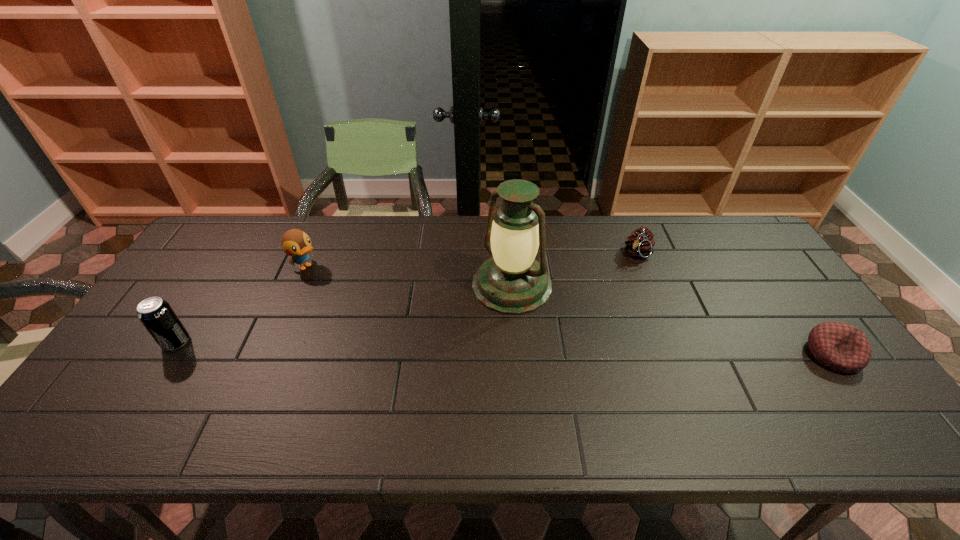
Find the location of `free space located 0.300m on the front-facing side of the duck`. free space located 0.300m on the front-facing side of the duck is located at coordinates (384, 316).

Locate an element on the screen. vacant region located on the front-facing side of the duck is located at coordinates (376, 312).

What are the coordinates of `blank area located 0.200m on the front-facing side of the duck` in the screenshot? It's located at (359, 301).

Where is `free space located 0.310m with a leaf charm attached to the fourth tallest object`? The height and width of the screenshot is (540, 960). free space located 0.310m with a leaf charm attached to the fourth tallest object is located at coordinates (598, 328).

You are a GUI agent. You are given a task and a screenshot of the screen. Output one action in this format:
    pyautogui.click(x=<x>, y=<y>)
    Task: Click on the free space located with a leaf charm attached to the fourth tallest object
    Image resolution: width=960 pixels, height=540 pixels.
    Given the screenshot: What is the action you would take?
    pyautogui.click(x=603, y=321)

Find the location of `free space located with a leaf charm attached to the fourth tallest object`. free space located with a leaf charm attached to the fourth tallest object is located at coordinates (590, 342).

You are a GUI agent. You are given a task and a screenshot of the screen. Output one action in this format:
    pyautogui.click(x=<x>, y=<y>)
    Task: Click on the vacant space located with the light compartment facing forward on the third object from left to right
    
    Given the screenshot: What is the action you would take?
    pyautogui.click(x=400, y=389)

Identify the location of blank area located with the light compartment facing forward on the third object from left to right. This screenshot has width=960, height=540. (440, 352).

I want to click on free point located with the light compartment facing forward on the third object from left to right, so click(385, 403).

Image resolution: width=960 pixels, height=540 pixels. Find the location of `duck that is at the far edge`. duck that is at the far edge is located at coordinates [x=295, y=243].